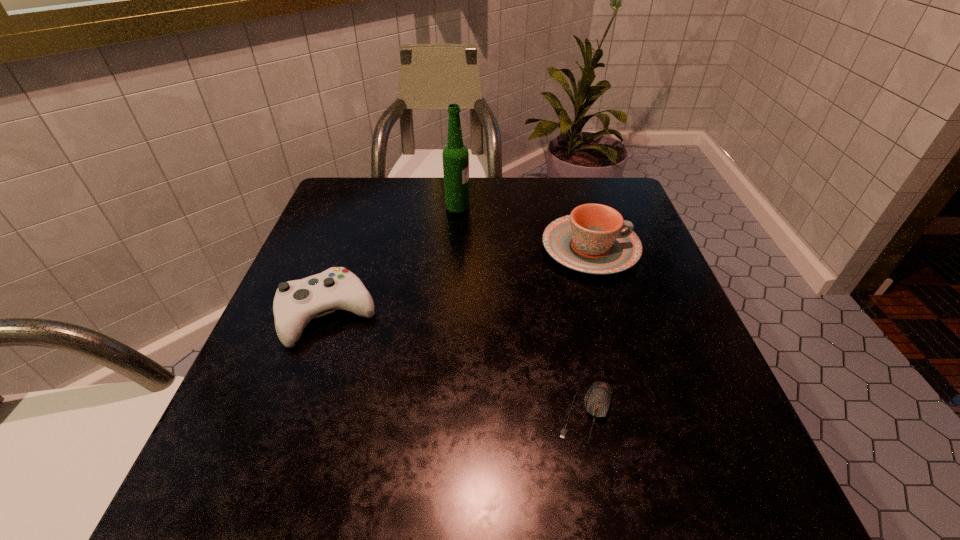
Identify the location of the third object from right to left. Image resolution: width=960 pixels, height=540 pixels. (455, 155).

You are a GUI agent. You are given a task and a screenshot of the screen. Output one action in this format:
    pyautogui.click(x=<x>, y=<y>)
    Task: Click on the tallest object
    This screenshot has width=960, height=540.
    Given the screenshot: What is the action you would take?
    click(x=455, y=155)

You are a GUI agent. You are given a task and a screenshot of the screen. Output one action in this format:
    pyautogui.click(x=<x>, y=<y>)
    Task: Click on the third shortest object
    Image resolution: width=960 pixels, height=540 pixels.
    Given the screenshot: What is the action you would take?
    pyautogui.click(x=594, y=239)

This screenshot has height=540, width=960. I want to click on the third nearest object, so click(594, 239).

You are a GUI agent. You are given a task and a screenshot of the screen. Output one action in this format:
    pyautogui.click(x=<x>, y=<y>)
    Task: Click on the control
    
    Given the screenshot: What is the action you would take?
    pyautogui.click(x=296, y=303)

Where is `the second nearest object`? This screenshot has width=960, height=540. the second nearest object is located at coordinates (296, 303).

The image size is (960, 540). I want to click on the shortest object, so [597, 401].

This screenshot has width=960, height=540. Identify the location of mouse. (597, 401).

The height and width of the screenshot is (540, 960). Find the location of `vacant space positioned on the label of the beer bottle`. vacant space positioned on the label of the beer bottle is located at coordinates (605, 206).

Where is `free region located on the back of the leftmost object`? Image resolution: width=960 pixels, height=540 pixels. free region located on the back of the leftmost object is located at coordinates (361, 221).